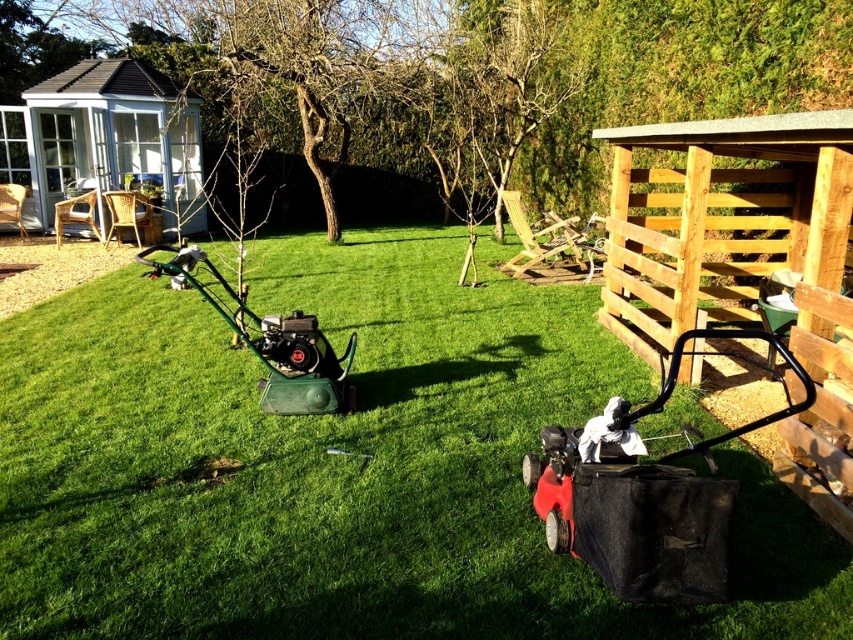
Does green grass at center have a lesser height compared to white wooden hut at upper left?

Indeed, green grass at center has a lesser height compared to white wooden hut at upper left.

Can you confirm if green grass at center is bigger than white wooden hut at upper left?

No.

What do you see at coordinates (341, 465) in the screenshot? I see `green grass at center` at bounding box center [341, 465].

Where is `green grass at center`? green grass at center is located at coordinates (341, 465).